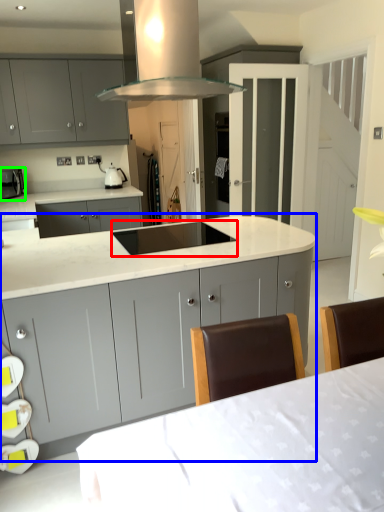
Question: Which is nearer to the sink (highlighted by a red box)? cabinetry (highlighted by a blue box) or kitchen appliance (highlighted by a green box).

Choices:
 (A) cabinetry
 (B) kitchen appliance

Answer: (A)